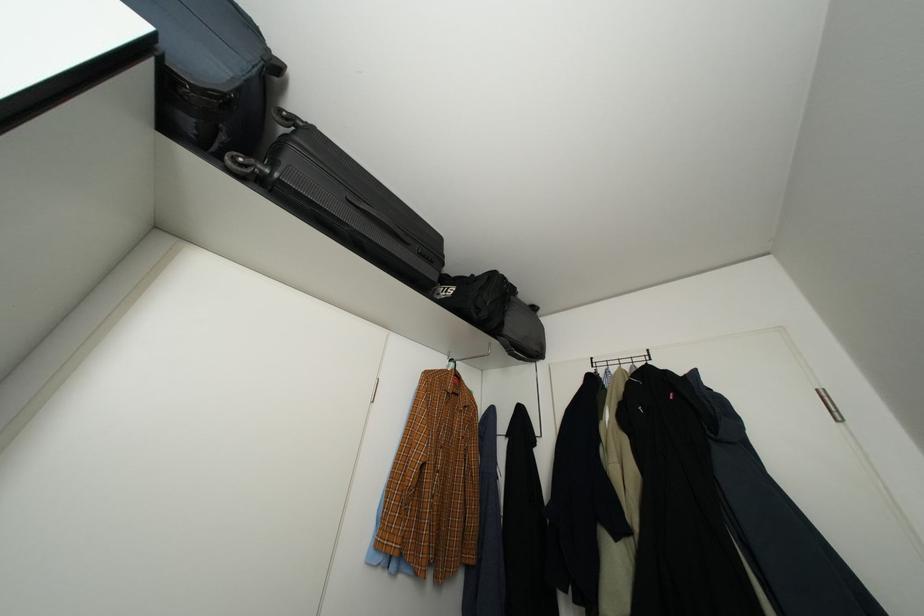
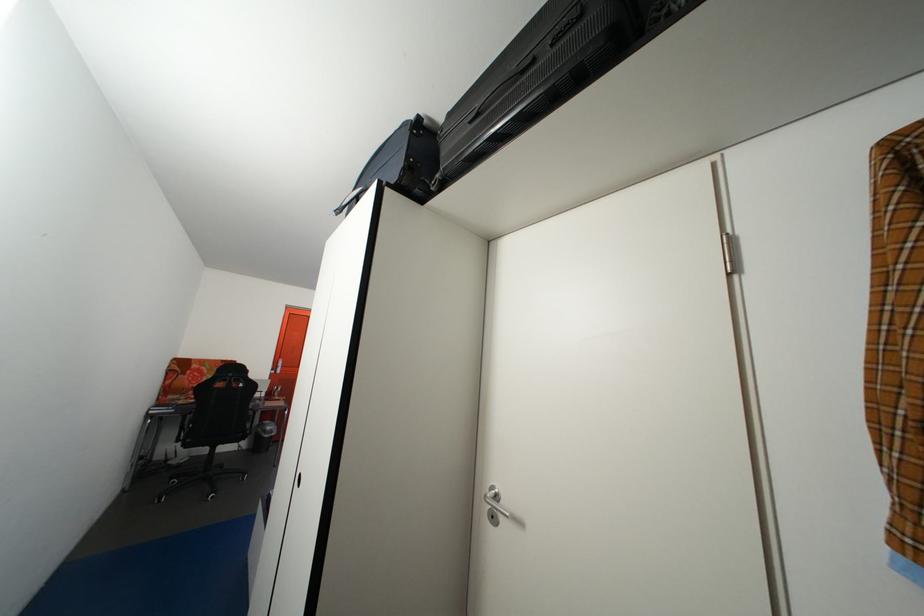
How did the camera likely rotate?

The camera's rotation is toward left-up.